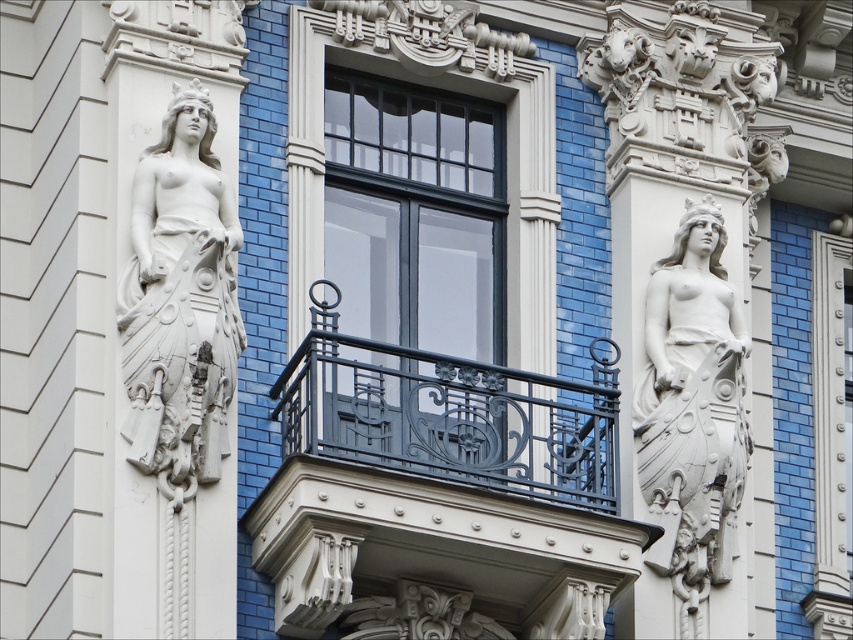
You are an architect examining the building facade. You need to determine the spatial relationship between the dark gray wrought iron balcony at center and the white stone statue at right. Based on the scene, which object is closer to the viewer?

The dark gray wrought iron balcony at center is closer to the viewer because it is positioned in front of the white stone statue at right.

You are standing in front of the building facade and want to take a photo of the white stone statue at left and the matte black window at center. If your camera has a maximum focus range of 30 feet, will both objects be in focus?

The white stone statue at left is 31.98 feet away from the matte black window at center. Since the camera can only focus up to 30 feet, the statue and window are slightly beyond the camera range, so they might not be in focus.

You are standing in front of the ornate building facade and want to take a photo of the point at coordinates point (300,54). Considering the distance between you and that point is 68.21 meters, will you need a telephoto lens to capture it clearly?

The point (300,54) is 68.21 meters away from you. Since this distance is quite far, you will need a telephoto lens to capture it clearly.